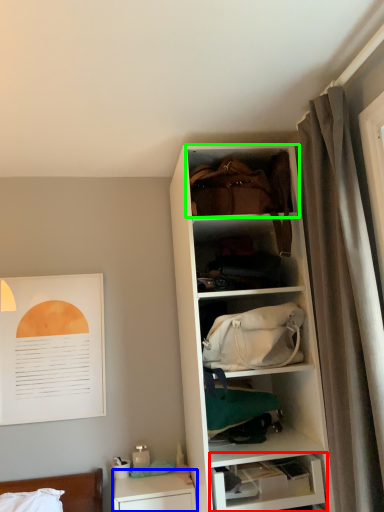
Question: Estimate the real-world distances between objects in this image. Which object is closer to shelf (highlighted by a red box), table (highlighted by a blue box) or cabinet (highlighted by a green box)?

Choices:
 (A) table
 (B) cabinet

Answer: (A)